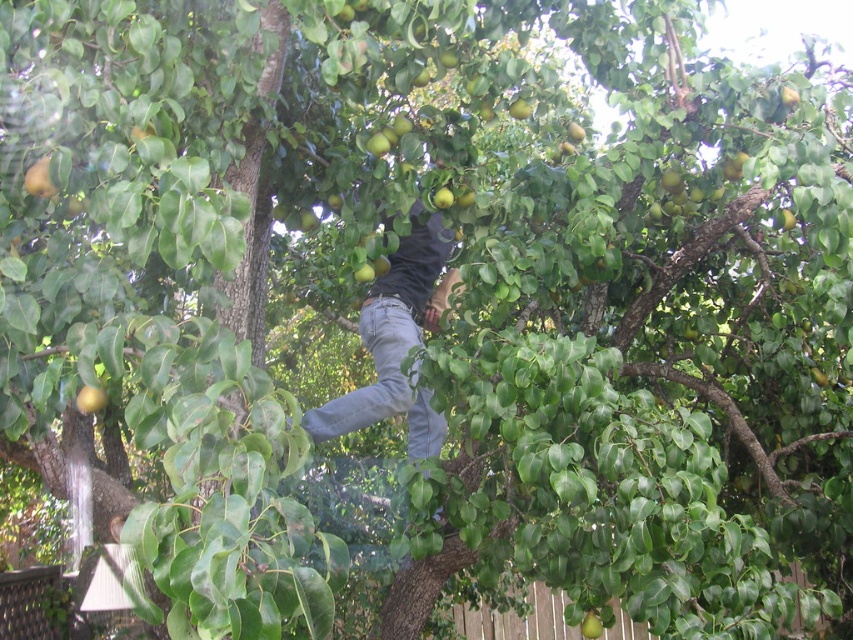
You are a fruit picker with a 1.5 meter long pole. You see the green matte apple at upper left and the green matte apple at center. Can you reach both apples with your pole?

The distance between the green matte apple at upper left and the green matte apple at center is 1.85 meters. Since your pole is only 1.5 meters long, you cannot reach both apples with the same pole.